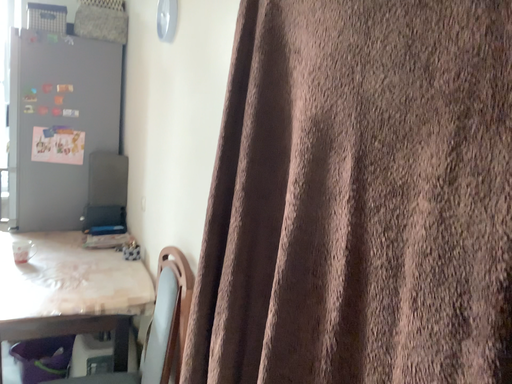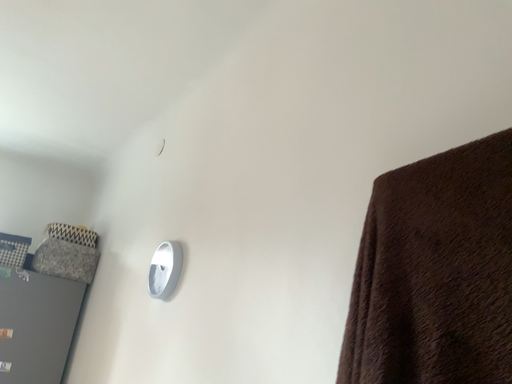
Question: Which way did the camera rotate in the video?

Choices:
 (A) rotated downward
 (B) rotated upward

Answer: (B)